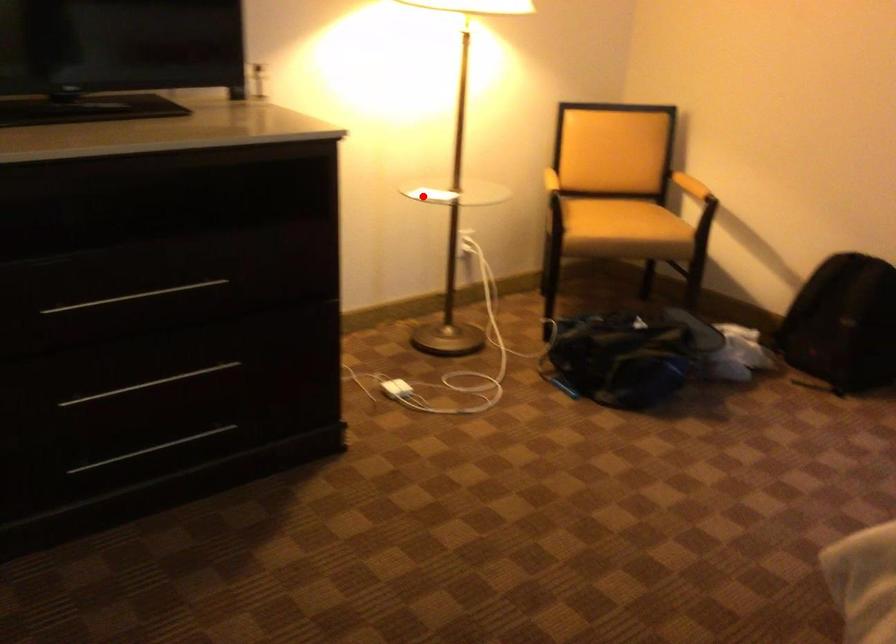
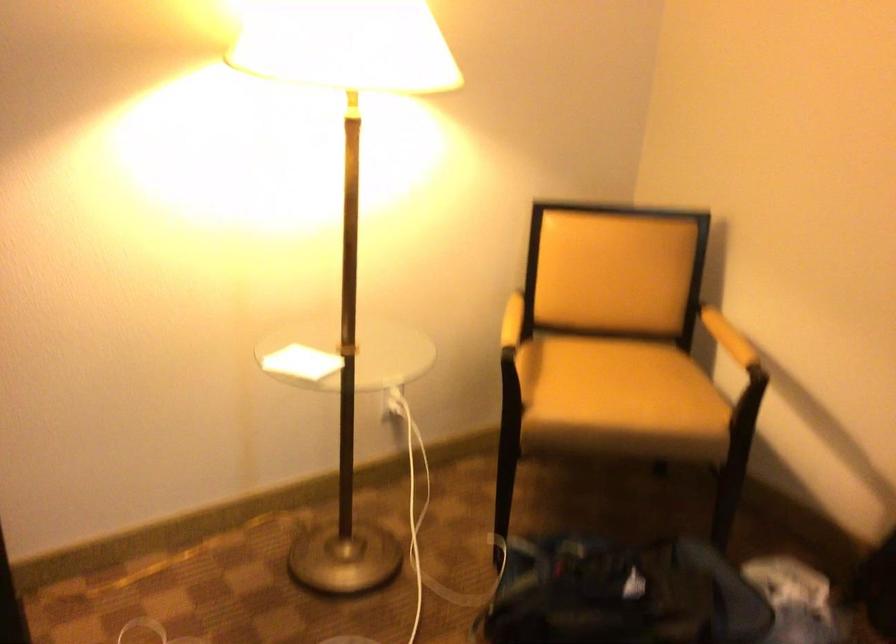
Find the pixel in the second image that matches the highlighted location in the first image.

(300, 363)